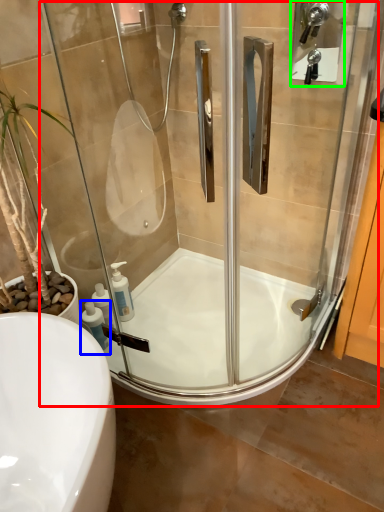
Question: Based on their relative distances, which object is farther from screen door (highlighted by a red box)? Choose from soap dispenser (highlighted by a blue box) and shower (highlighted by a green box).

Choices:
 (A) soap dispenser
 (B) shower

Answer: (B)